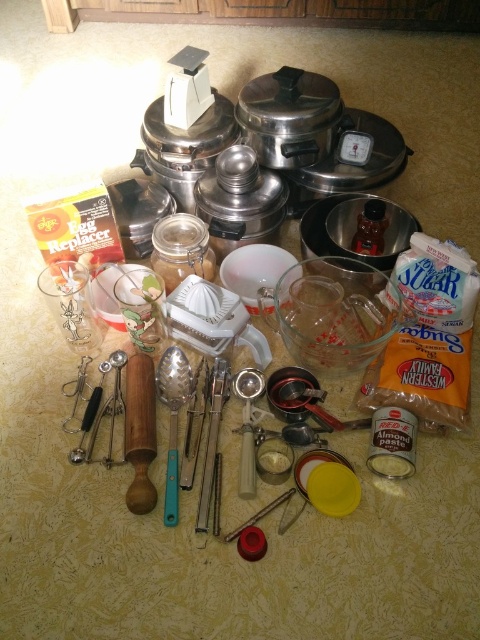
Question: Which point is closer to the camera taking this photo?

Choices:
 (A) (217, 438)
 (B) (175, 400)
 (C) (252, 440)

Answer: (C)

Question: Is teal plastic spoon at center thinner than metallic silver measuring cup at center?

Choices:
 (A) yes
 (B) no

Answer: (B)

Question: Considering the real-world distances, which object is closest to the metallic silver measuring cup at center?

Choices:
 (A) silver metallic utensils at center
 (B) teal plastic spoon at center

Answer: (A)

Question: Can you confirm if teal plastic spoon at center is thinner than silver metallic utensils at center?

Choices:
 (A) no
 (B) yes

Answer: (A)

Question: Does metallic silver measuring cup at center come behind silver metallic utensils at center?

Choices:
 (A) yes
 (B) no

Answer: (A)

Question: Which point is closer to the camera?

Choices:
 (A) (204, 522)
 (B) (177, 433)

Answer: (A)